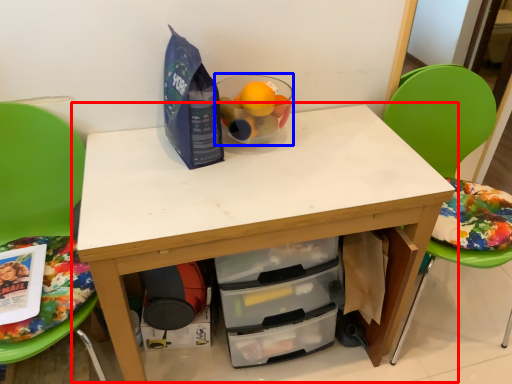
Question: Among these objects, which one is nearest to the camera, table (highlighted by a red box) or bowl (highlighted by a blue box)?

Choices:
 (A) table
 (B) bowl

Answer: (A)